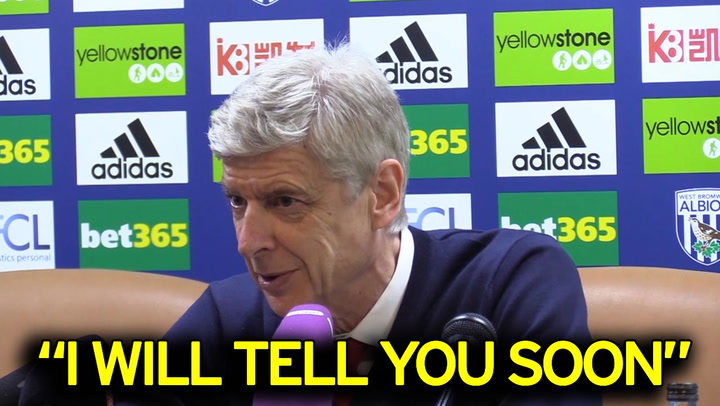
Find the location of a particular element. The width and height of the screenshot is (720, 406). wall is located at coordinates tap(551, 139).